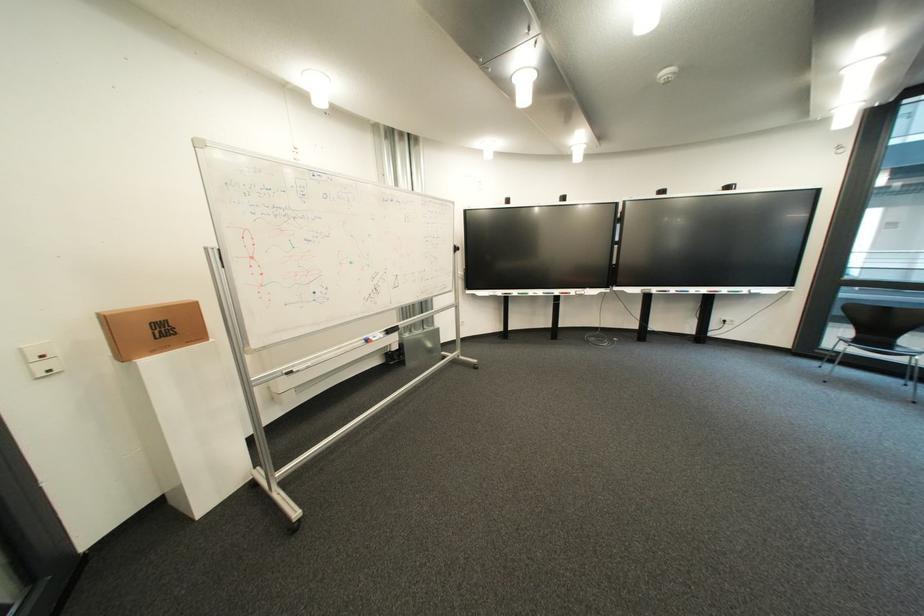
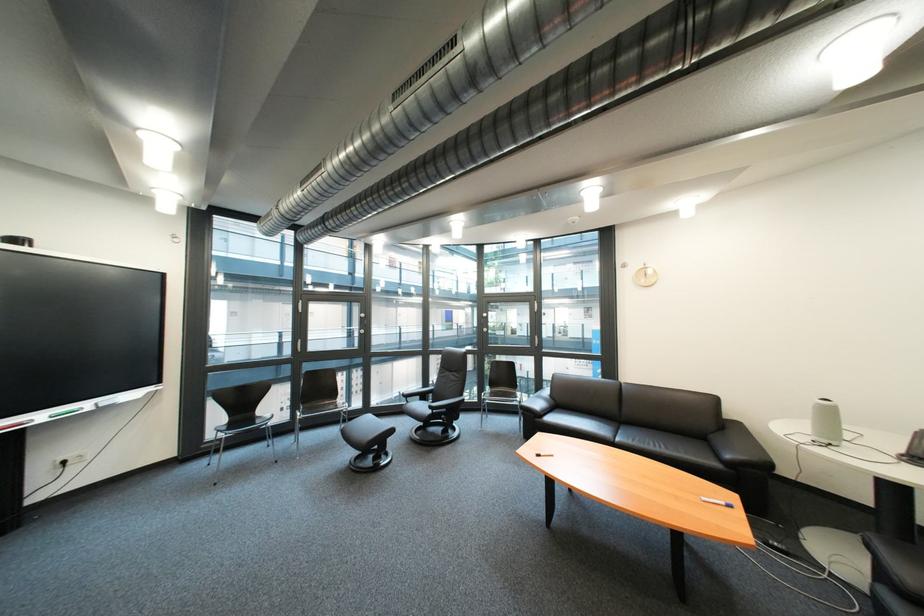
Locate, in the second image, the point that corresponds to the point at 758,292 in the first image.

(101, 406)